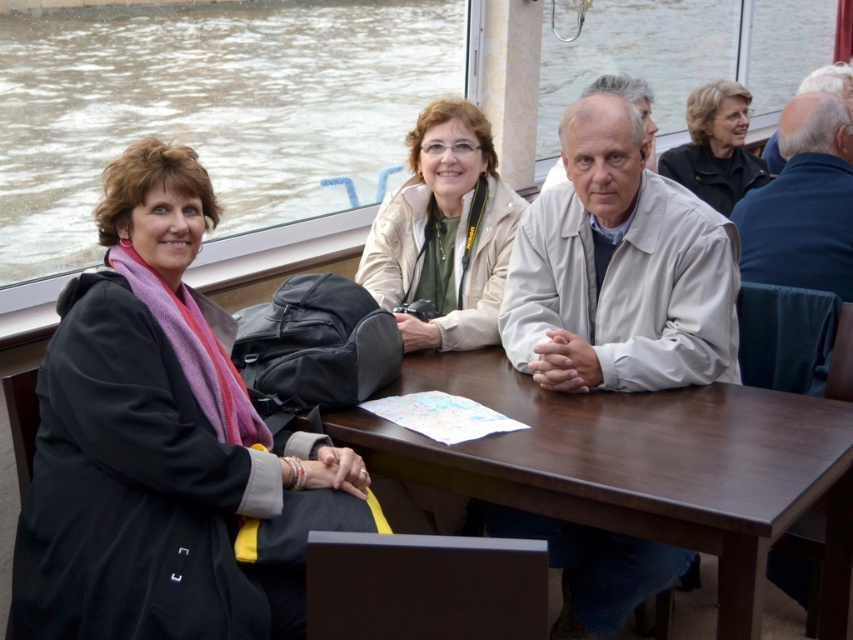
You are a photographer trying to capture a photo of the white matte jacket at center and the black leather jacket at upper right. Which jacket should you focus on first if you want to include both in your shot without moving the camera?

You should focus on the white matte jacket at center first because it is positioned to the left of the black leather jacket at upper right, so capturing it first ensures both are in frame without needing to adjust the camera angle.

You are standing at the point marked as point (463,24) in the image. You want to reach the nearest emergency exit, which is 15 feet away from you. Can you walk straight ahead without obstacles? The image shows a boat interior with people seated at a table and a backpack on it.

The point (463,24) is 12.54 feet away from the viewer. Since the emergency exit is 15 feet away, you are still 2.46 feet away from the exit and can walk straight ahead without obstacles as there are no mentioned obstacles in the scene description.